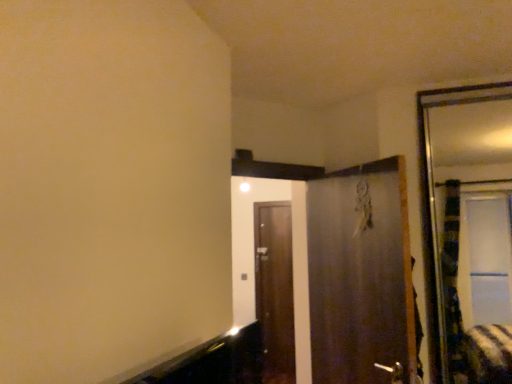
Question: Does point (335, 281) appear closer or farther from the camera than point (274, 226)?

Choices:
 (A) closer
 (B) farther

Answer: (A)

Question: Is metallic silver door at center, arranged as the second door when viewed from the back, in front of or behind brown wooden door at center, the first door from the back, in the image?

Choices:
 (A) front
 (B) behind

Answer: (A)

Question: Based on their relative distances, which object is nearer to the brown wooden door at center, the second door positioned from the front?

Choices:
 (A) metallic silver door at center, arranged as the first door when viewed from the front
 (B) silver metallic door handle at lower center

Answer: (A)

Question: Which is nearer to the silver metallic door handle at lower center?

Choices:
 (A) brown wooden door at center, the first door from the back
 (B) metallic silver door at center, arranged as the first door when viewed from the front

Answer: (B)